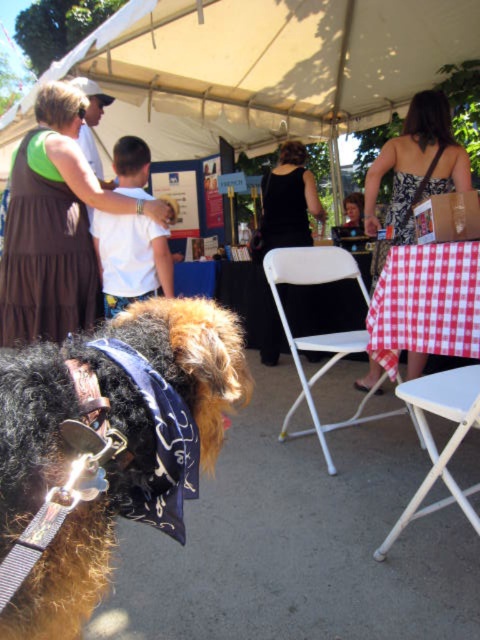
You are organizing a photo shoot and need to ensure that the black lace dress at center and the white plastic chair at center are both visible in the frame. Given their sizes, which object should you prioritize positioning closer to the camera to maintain clarity?

The black lace dress at center is smaller than the white plastic chair at center, so you should prioritize positioning the black lace dress at center closer to the camera to ensure it remains visible and clear in the photo shoot frame.

You are standing at the center of the image and want to locate the white cotton shirt at upper left. In which direction should you look to find it?

You should look to the upper left direction to find the white cotton shirt at upper left since it is positioned at point (55, 225) which is in the upper left quadrant of the image.